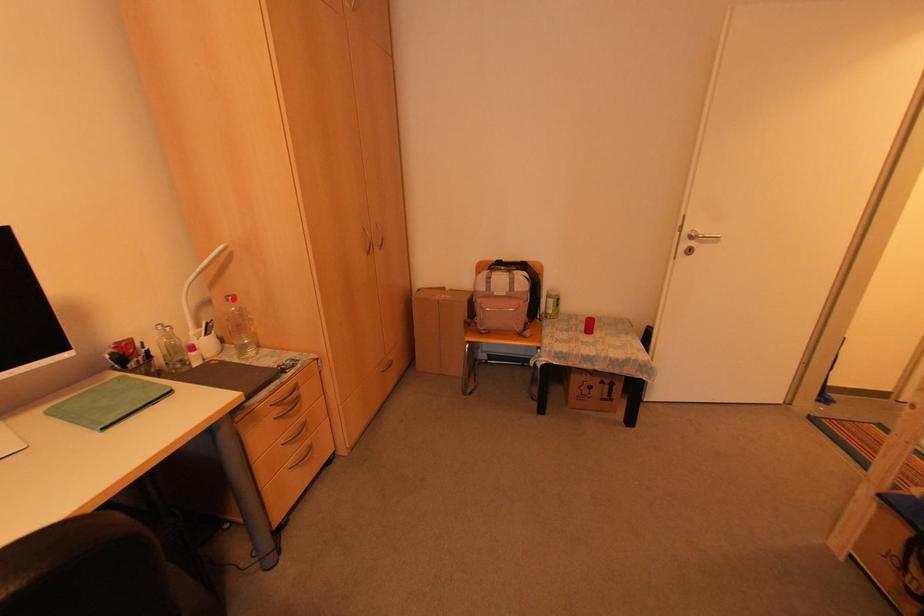
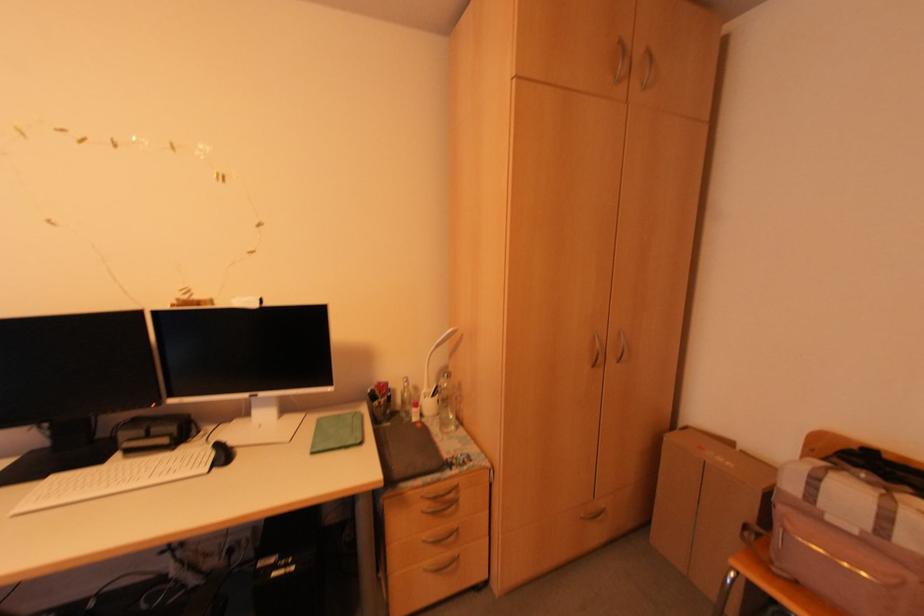
In the second image, find the point that corresponds to the highlighted location in the first image.

(446, 377)